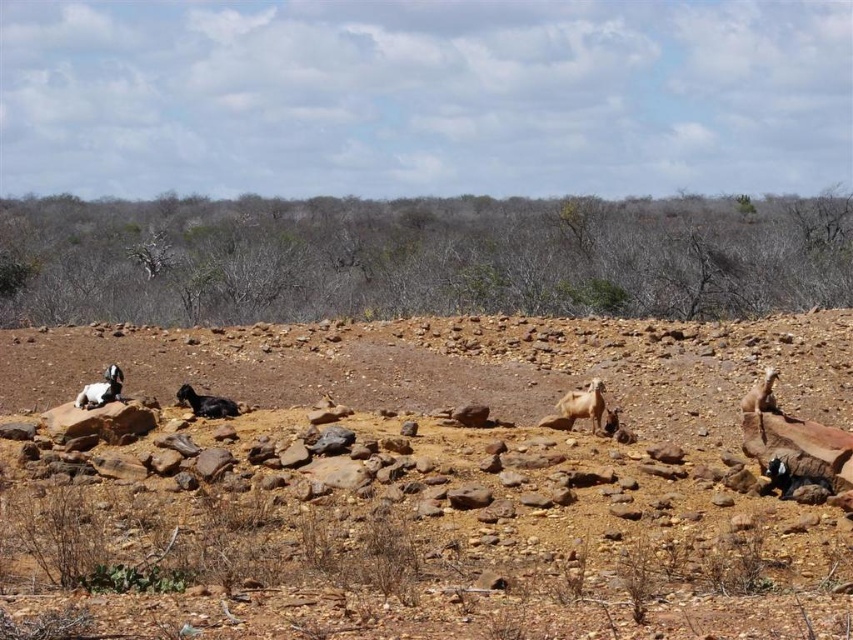
This screenshot has height=640, width=853. I want to click on black fuzzy goat at center, so click(206, 403).

Is black fuzzy goat at center taller than white woolen goat at left?

In fact, black fuzzy goat at center may be shorter than white woolen goat at left.

Based on the photo, who is more forward, (196, 410) or (105, 397)?

Point (105, 397) is in front.

Where is `black fuzzy goat at center`? black fuzzy goat at center is located at coordinates (206, 403).

Between white woolly goat at center and black fuzzy goat at center, which one is positioned higher?

black fuzzy goat at center is above.

Does white woolly goat at center lie behind black fuzzy goat at center?

No, white woolly goat at center is closer to the viewer.

Which is in front, point (561, 412) or point (184, 397)?

Positioned in front is point (184, 397).

Find the location of `white woolly goat at center`. white woolly goat at center is located at coordinates (583, 404).

Measure the distance between point (293, 228) and camera.

They are 53.39 meters apart.

Who is shorter, brown dry shrubs at center or white woolly goat at center?

With less height is white woolly goat at center.

This screenshot has width=853, height=640. Describe the element at coordinates (422, 257) in the screenshot. I see `brown dry shrubs at center` at that location.

Find the location of a particular element. brown dry shrubs at center is located at coordinates pos(422,257).